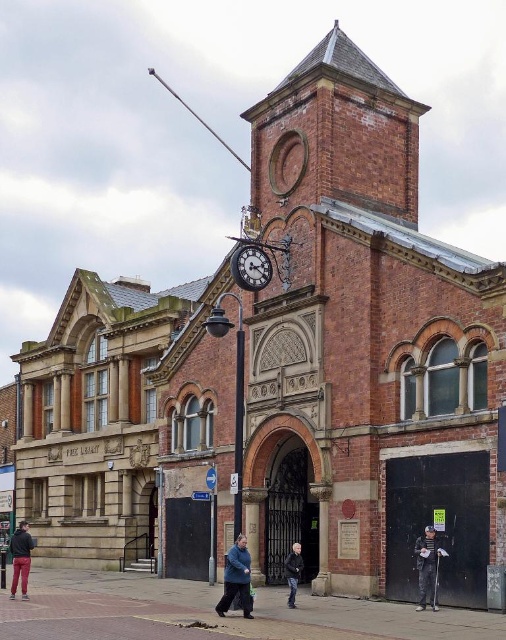
You are standing at the entrance of the historic library building. You see a polished brass clock at center and a matte black jacket at lower left. If you want to reach both items, which one do you need to walk towards first to get closer to them?

The polished brass clock at center is closer to you than the matte black jacket at lower left, so you should walk towards the polished brass clock at center first to get closer to both items.